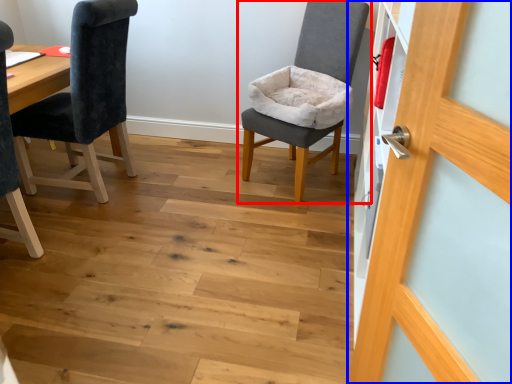
Question: Which of the following is the farthest to the observer, chair (highlighted by a red box) or door (highlighted by a blue box)?

Choices:
 (A) chair
 (B) door

Answer: (A)